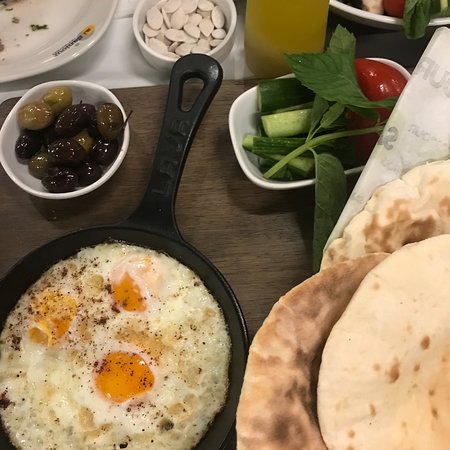
The image size is (450, 450). I want to click on bowl, so click(x=109, y=172).